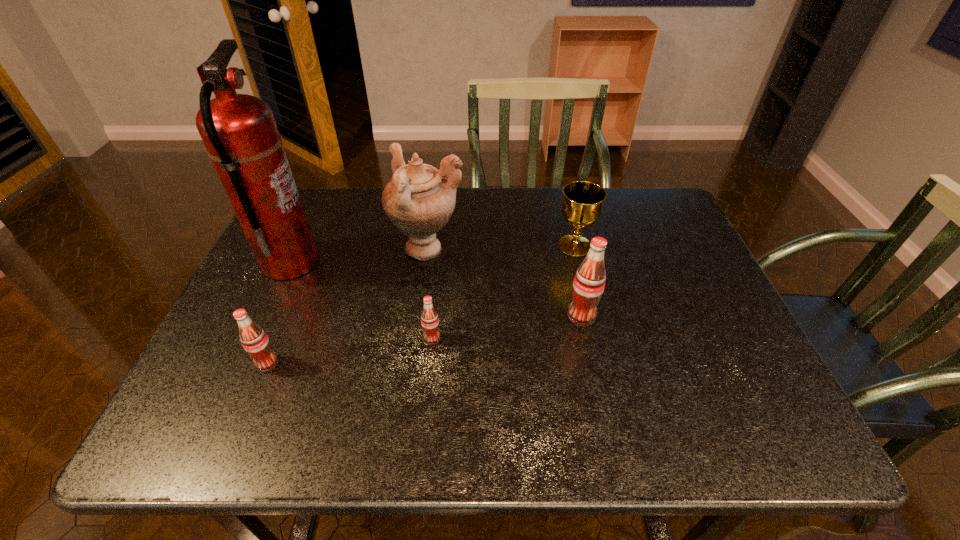
Find the location of a particular element. The image size is (960, 540). vacant region that satisfies the following two spatial constraints: 1. on the back side of the shortest object; 2. on the nozzle side of the tallest object is located at coordinates (440, 263).

This screenshot has width=960, height=540. Find the location of `free spot that satisfies the following two spatial constraints: 1. on the back side of the tallest soda; 2. on the left side of the chalice`. free spot that satisfies the following two spatial constraints: 1. on the back side of the tallest soda; 2. on the left side of the chalice is located at coordinates (566, 245).

Locate an element on the screen. free spot that satisfies the following two spatial constraints: 1. on the back side of the chalice; 2. on the right side of the nearest soda is located at coordinates (316, 245).

Locate an element on the screen. The image size is (960, 540). free space that satisfies the following two spatial constraints: 1. on the back side of the chalice; 2. on the left side of the urn is located at coordinates (429, 245).

I want to click on vacant space that satisfies the following two spatial constraints: 1. on the nozzle side of the second soda from right to left; 2. on the left side of the fire extinguisher, so click(255, 339).

Where is `free space that satisfies the following two spatial constraints: 1. on the back side of the chalice; 2. on the right side of the leftmost soda`? The width and height of the screenshot is (960, 540). free space that satisfies the following two spatial constraints: 1. on the back side of the chalice; 2. on the right side of the leftmost soda is located at coordinates (316, 245).